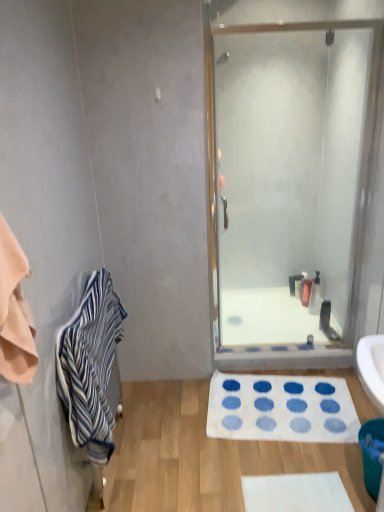
Question: Looking at their shapes, would you say translucent plastic soap dispenser at center is wider or thinner than blue striped towel at left?

Choices:
 (A) thin
 (B) wide

Answer: (A)

Question: Is translucent plastic soap dispenser at center spatially inside blue striped towel at left, or outside of it?

Choices:
 (A) outside
 (B) inside

Answer: (A)

Question: Which object is positioned closest to the teal plastic trash can at lower right?

Choices:
 (A) blue striped towel at left
 (B) translucent plastic soap dispenser at center
 (C) white fabric mat at lower center
 (D) white textured bath mat at center
 (E) clear glass shower door at center

Answer: (D)

Question: Considering the real-world distances, which object is closest to the white fabric mat at lower center?

Choices:
 (A) white glossy bath at center
 (B) blue striped towel at left
 (C) white textured bath mat at center
 (D) clear glass shower door at center
 (E) translucent plastic soap dispenser at center

Answer: (C)